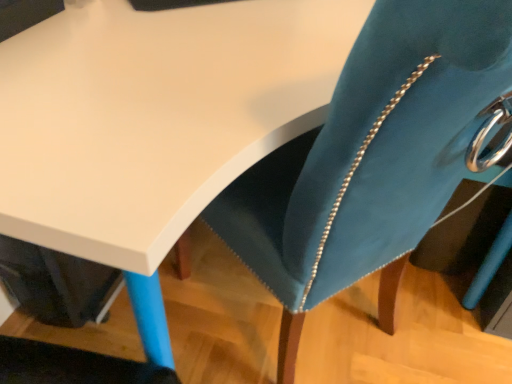
Where is `velvet teal swivel chair at center`? velvet teal swivel chair at center is located at coordinates (369, 159).

Measure the distance between velvet teal swivel chair at center and camera.

velvet teal swivel chair at center and camera are 9.81 inches apart.

In order to face velvet teal swivel chair at center, should I rotate leftwards or rightwards?

Rotate right and turn 9.848 degrees.

Image resolution: width=512 pixels, height=384 pixels. Describe the element at coordinates (369, 159) in the screenshot. I see `velvet teal swivel chair at center` at that location.

Describe the element at coordinates (154, 122) in the screenshot. I see `matte white table at upper left` at that location.

Locate an element on the screen. matte white table at upper left is located at coordinates (154, 122).

Where is `velvet teal swivel chair at center`? This screenshot has height=384, width=512. velvet teal swivel chair at center is located at coordinates (369, 159).

Which is more to the right, velvet teal swivel chair at center or matte white table at upper left?

Positioned to the right is velvet teal swivel chair at center.

Considering the positions of objects velvet teal swivel chair at center and matte white table at upper left in the image provided, who is in front, velvet teal swivel chair at center or matte white table at upper left?

velvet teal swivel chair at center is more forward.

Which is closer, (362, 80) or (242, 102)?

Point (362, 80)

From the image's perspective, is velvet teal swivel chair at center above or below matte white table at upper left?

Clearly, from the image's perspective, velvet teal swivel chair at center is below matte white table at upper left.

From a real-world perspective, is velvet teal swivel chair at center under matte white table at upper left?

No, from a real-world perspective, velvet teal swivel chair at center is not under matte white table at upper left.

Is velvet teal swivel chair at center wider or thinner than matte white table at upper left?

Considering their sizes, velvet teal swivel chair at center looks slimmer than matte white table at upper left.

Does velvet teal swivel chair at center have a greater height compared to matte white table at upper left?

Indeed, velvet teal swivel chair at center has a greater height compared to matte white table at upper left.

Which of these two, velvet teal swivel chair at center or matte white table at upper left, is bigger?

matte white table at upper left is bigger.

Is velvet teal swivel chair at center spatially inside matte white table at upper left, or outside of it?

The correct answer is: inside.

Are velvet teal swivel chair at center and matte white table at upper left making contact?

No, velvet teal swivel chair at center is not with matte white table at upper left.

Is velvet teal swivel chair at center facing towards matte white table at upper left?

Yes.

Locate an element on the screen. This screenshot has height=384, width=512. table that is behind the velvet teal swivel chair at center is located at coordinates (154, 122).

Considering the positions of objects matte white table at upper left and velvet teal swivel chair at center in the image provided, who is more to the right, matte white table at upper left or velvet teal swivel chair at center?

Positioned to the right is velvet teal swivel chair at center.

Which is in front, matte white table at upper left or velvet teal swivel chair at center?

velvet teal swivel chair at center is in front.

Which is closer, (241, 38) or (350, 241)?

Point (241, 38) is positioned farther from the camera compared to point (350, 241).

From the image's perspective, is matte white table at upper left located beneath velvet teal swivel chair at center?

No, from the image's perspective, matte white table at upper left is not beneath velvet teal swivel chair at center.

From a real-world perspective, is matte white table at upper left over velvet teal swivel chair at center?

No, from a real-world perspective, matte white table at upper left is not above velvet teal swivel chair at center.

Consider the image. Looking at their sizes, would you say matte white table at upper left is wider or thinner than velvet teal swivel chair at center?

Clearly, matte white table at upper left has more width compared to velvet teal swivel chair at center.

Is matte white table at upper left taller than velvet teal swivel chair at center?

No.

Looking at the image, does matte white table at upper left seem bigger or smaller compared to velvet teal swivel chair at center?

Considering their sizes, matte white table at upper left takes up more space than velvet teal swivel chair at center.

Is matte white table at upper left surrounding velvet teal swivel chair at center?

Indeed, velvet teal swivel chair at center is located within matte white table at upper left.

Is matte white table at upper left with velvet teal swivel chair at center?

No, matte white table at upper left is not making contact with velvet teal swivel chair at center.

Is matte white table at upper left turned away from velvet teal swivel chair at center?

Yes, matte white table at upper left is facing away from velvet teal swivel chair at center.

Can you tell me how much matte white table at upper left and velvet teal swivel chair at center differ in facing direction?

The angular difference between matte white table at upper left and velvet teal swivel chair at center is 137 degrees.

You are a GUI agent. You are given a task and a screenshot of the screen. Output one action in this format:
    pyautogui.click(x=<x>, y=<y>)
    Task: Click on the swivel chair on the right of matte white table at upper left
    The width and height of the screenshot is (512, 384).
    Given the screenshot: What is the action you would take?
    pyautogui.click(x=369, y=159)

The height and width of the screenshot is (384, 512). Identify the location of table to the left of velvet teal swivel chair at center. (154, 122).

The width and height of the screenshot is (512, 384). I want to click on swivel chair lying in front of the matte white table at upper left, so click(369, 159).